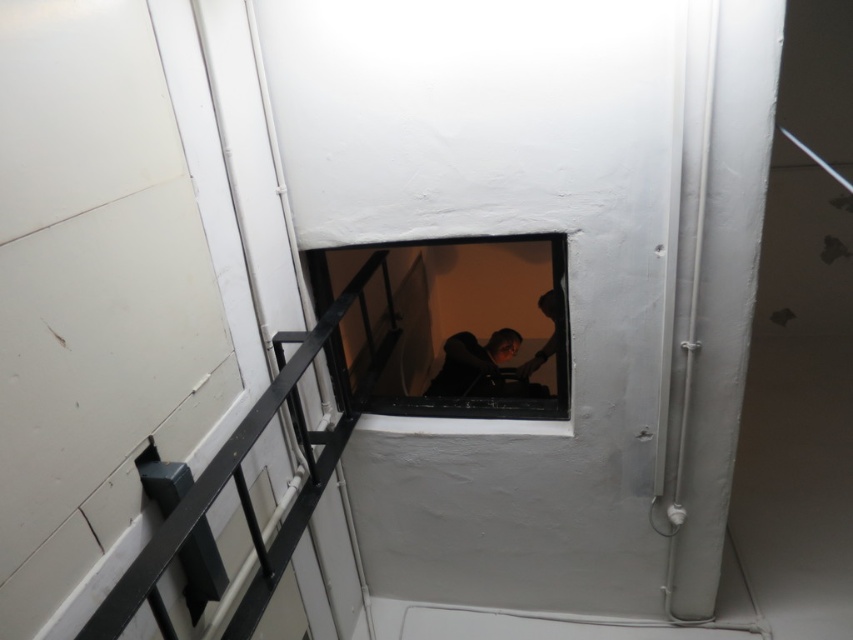
You are a delivery robot with a height of 1.6 meters. You need to pass through the narrow space shown in the image. The transparent glass window at center and the smooth skin person at center are both in your path. Can you fit through without bending down, considering their heights?

The transparent glass window at center is taller than the smooth skin person at center. Since the robot is 1.6 meters tall, it must ensure that the window is at least that height. However, since the window is taller than the person, but we don not have the exact height of the person, we cannot definitively determine if the robot can pass without bending down. Additional information about the person or window height is needed.

You are a maintenance worker needing to access the pipes on the walls in this narrow space. The transparent glass window at center and dark hair at center are in your way. Which object should you move first to gain access to the pipes?

The dark hair at center should be moved first because it is smaller than the transparent glass window at center, making it easier to clear the path.

Based on the photo, you are a delivery robot with a width of 24 inches. You need to pass through the space between the transparent glass window at center and the smooth skin person at center. Can you fit through this space?

The transparent glass window at center and the smooth skin person at center are 32.65 inches apart from each other. Since the robot is 24 inches wide, it can fit through the space as there is enough clearance between the two objects.